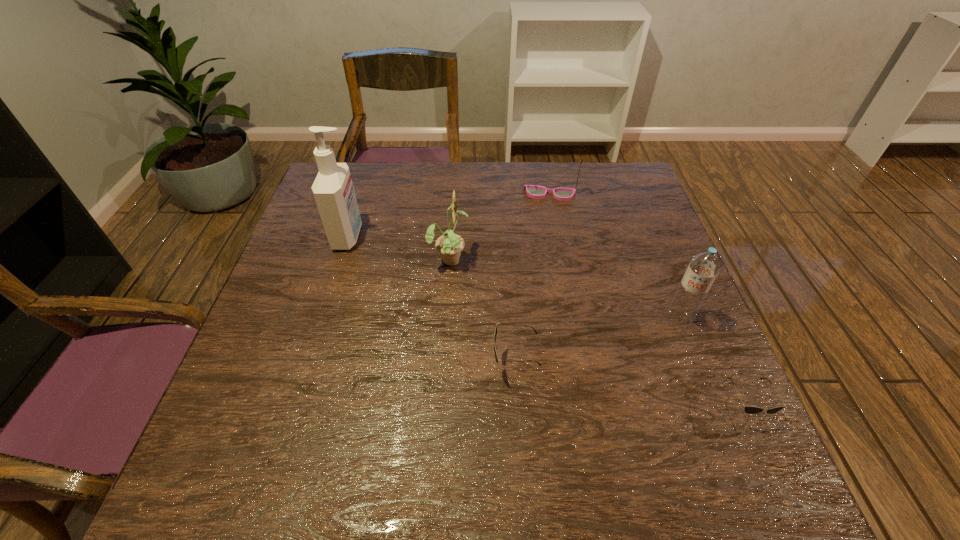
This screenshot has width=960, height=540. I want to click on the taller sunglasses, so click(495, 331).

Identify the location of the left sunglasses. (495, 331).

This screenshot has width=960, height=540. Identify the location of the shorter sunglasses. (748, 409).

You are a GUI agent. You are given a task and a screenshot of the screen. Output one action in this format:
    pyautogui.click(x=<x>, y=<y>)
    Task: Click on the shortest object
    The width and height of the screenshot is (960, 540).
    Given the screenshot: What is the action you would take?
    pyautogui.click(x=748, y=409)

Locate an element on the screen. The height and width of the screenshot is (540, 960). the third shortest object is located at coordinates (534, 191).

This screenshot has height=540, width=960. I want to click on the farthest object, so click(534, 191).

Image resolution: width=960 pixels, height=540 pixels. Identify the location of the fifth object from right to left. (449, 245).

Where is `water bottle`? water bottle is located at coordinates (703, 268).

Find the location of a particular element. This screenshot has width=960, height=540. the tallest object is located at coordinates (333, 190).

This screenshot has height=540, width=960. What are the coordinates of `the leftmost object` in the screenshot? It's located at (333, 190).